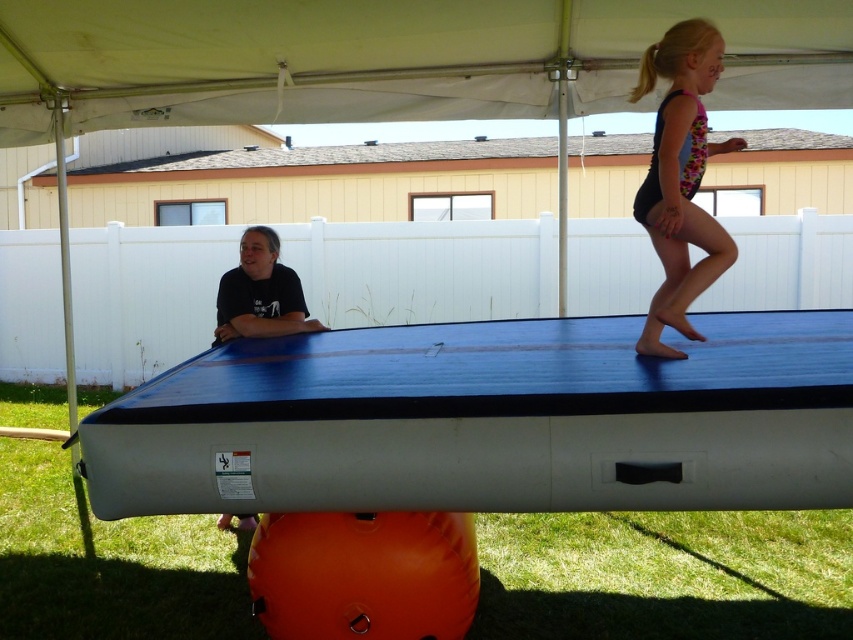
In the scene shown: Which of these two, multicolored leotard at upper right or black matte shirt at left, stands shorter?

black matte shirt at left

Can you confirm if multicolored leotard at upper right is bigger than black matte shirt at left?

Indeed, multicolored leotard at upper right has a larger size compared to black matte shirt at left.

Describe the element at coordinates (680, 179) in the screenshot. This screenshot has height=640, width=853. I see `multicolored leotard at upper right` at that location.

This screenshot has width=853, height=640. I want to click on multicolored leotard at upper right, so click(680, 179).

Is point (393, 353) closer to viewer compared to point (229, 285)?

Yes, point (393, 353) is closer to viewer.

Who is lower down, blue rubber mat at upper center or black matte shirt at left?

blue rubber mat at upper center is below.

Does point (767, 328) come in front of point (281, 301)?

Yes, it is in front of point (281, 301).

Locate an element on the screen. blue rubber mat at upper center is located at coordinates (488, 420).

Is blue rubber mat at upper center above multicolored leotard at upper right?

Actually, blue rubber mat at upper center is below multicolored leotard at upper right.

Does point (680, 486) come in front of point (672, 104)?

Yes, it is.

I want to click on blue rubber mat at upper center, so click(x=488, y=420).